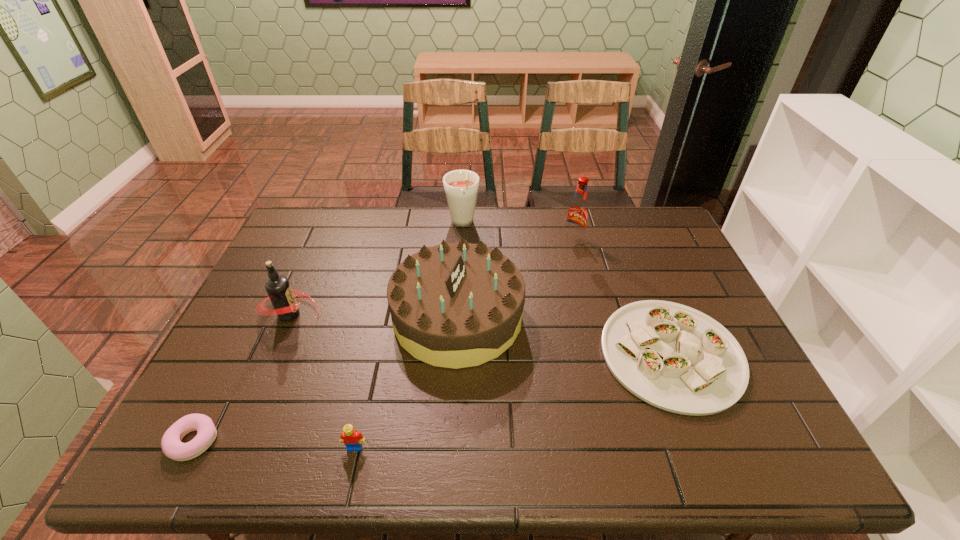
Locate which object is the fourth closest to the birthday cake. Please provide its 2D coordinates. Your answer should be formatted as a tuple, i.e. [(x, y)], where the tuple contains the x and y coordinates of a point satisfying the conditions above.

[(282, 296)]

Locate which object is the third closest to the second root beer from right to left. Please provide its 2D coordinates. Your answer should be formatted as a tuple, i.e. [(x, y)], where the tuple contains the x and y coordinates of a point satisfying the conditions above.

[(282, 296)]

Select which root beer appears as the closest to the birthday cake. Please provide its 2D coordinates. Your answer should be formatted as a tuple, i.e. [(x, y)], where the tuple contains the x and y coordinates of a point satisfying the conditions above.

[(461, 186)]

Select which root beer is the second closest to the leftmost root beer. Please provide its 2D coordinates. Your answer should be formatted as a tuple, i.e. [(x, y)], where the tuple contains the x and y coordinates of a point satisfying the conditions above.

[(577, 214)]

What are the coordinates of `free location that satisfies the following two spatial constraints: 1. on the front-facing side of the birthday cake; 2. on the left side of the sixth tallest object` in the screenshot? It's located at (456, 354).

Locate an element on the screen. The height and width of the screenshot is (540, 960). free location that satisfies the following two spatial constraints: 1. on the label of the shortest root beer; 2. on the right side of the platter is located at coordinates tap(273, 354).

Identify the location of free space that satisfies the following two spatial constraints: 1. on the front side of the platter; 2. on the right side of the rightmost root beer. (602, 354).

Identify the location of free space that satisfies the following two spatial constraints: 1. on the back side of the second shortest object; 2. on the label of the leftmost root beer. The height and width of the screenshot is (540, 960). (655, 314).

Identify the location of vacant space that satisfies the following two spatial constraints: 1. on the front-facing side of the platter; 2. on the left side of the birthday cake. This screenshot has height=540, width=960. (456, 354).